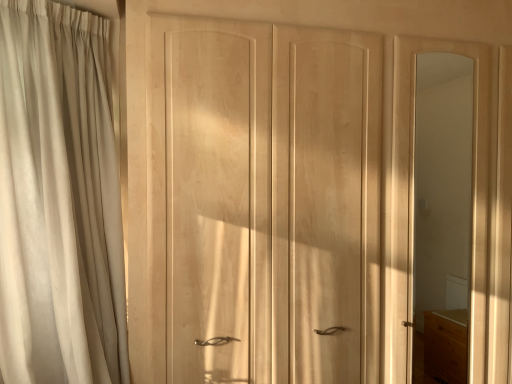
Question: Is beige fabric curtain at left aimed at natural wood wardrobe at center?

Choices:
 (A) no
 (B) yes

Answer: (A)

Question: From the image's perspective, is beige fabric curtain at left under natural wood wardrobe at center?

Choices:
 (A) yes
 (B) no

Answer: (B)

Question: Does beige fabric curtain at left lie behind natural wood wardrobe at center?

Choices:
 (A) yes
 (B) no

Answer: (B)

Question: Does beige fabric curtain at left appear on the right side of natural wood wardrobe at center?

Choices:
 (A) no
 (B) yes

Answer: (A)

Question: Is beige fabric curtain at left positioned far away from natural wood wardrobe at center?

Choices:
 (A) yes
 (B) no

Answer: (B)

Question: Is beige fabric curtain at left in front of or behind natural wood wardrobe at center in the image?

Choices:
 (A) front
 (B) behind

Answer: (A)

Question: Considering the positions of beige fabric curtain at left and natural wood wardrobe at center in the image, is beige fabric curtain at left wider or thinner than natural wood wardrobe at center?

Choices:
 (A) thin
 (B) wide

Answer: (B)

Question: Is beige fabric curtain at left situated inside natural wood wardrobe at center or outside?

Choices:
 (A) inside
 (B) outside

Answer: (B)

Question: Visually, is beige fabric curtain at left positioned to the left or to the right of natural wood wardrobe at center?

Choices:
 (A) left
 (B) right

Answer: (A)

Question: From the image's perspective, relative to beige fabric curtain at left, is matte wood mirror at right above or below?

Choices:
 (A) below
 (B) above

Answer: (A)

Question: From a real-world perspective, is matte wood mirror at right positioned above or below beige fabric curtain at left?

Choices:
 (A) below
 (B) above

Answer: (A)

Question: Is matte wood mirror at right in front of or behind beige fabric curtain at left in the image?

Choices:
 (A) front
 (B) behind

Answer: (B)

Question: In terms of width, does matte wood mirror at right look wider or thinner when compared to beige fabric curtain at left?

Choices:
 (A) thin
 (B) wide

Answer: (A)

Question: Is natural wood wardrobe at center spatially inside matte wood mirror at right, or outside of it?

Choices:
 (A) inside
 (B) outside

Answer: (B)

Question: Based on their positions, is natural wood wardrobe at center located to the left or right of matte wood mirror at right?

Choices:
 (A) right
 (B) left

Answer: (B)